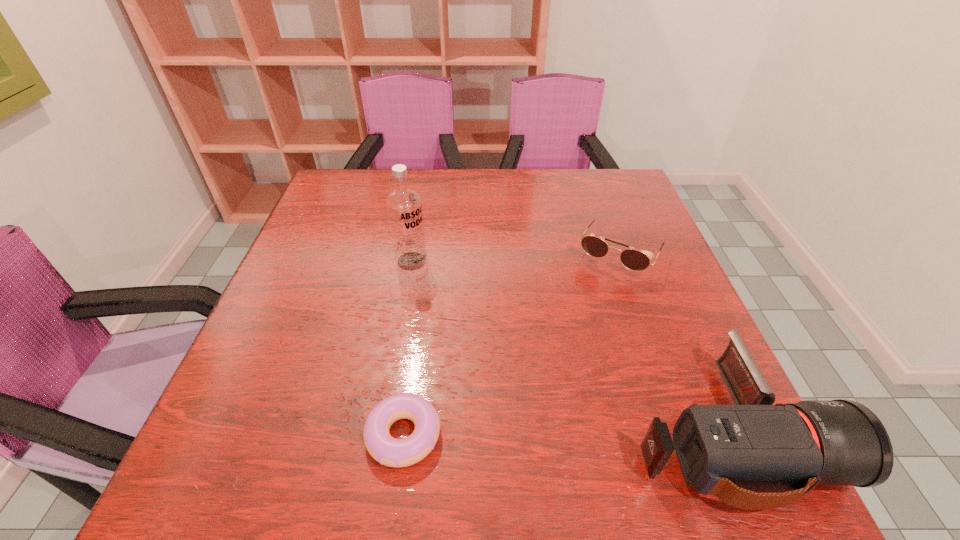
Where is `the shortest object`? This screenshot has height=540, width=960. the shortest object is located at coordinates (388, 451).

This screenshot has width=960, height=540. I want to click on camcorder, so click(x=729, y=451).

At what (x,y) coordinates should I click in order to perform the action: click on vodka. Please return your answer as a coordinate pair (x, y). The width and height of the screenshot is (960, 540). Looking at the image, I should click on (404, 205).

What are the coordinates of `sunglasses` in the screenshot? It's located at (635, 260).

Where is `blank area located 0.360m on the back of the shortest object`? This screenshot has width=960, height=540. blank area located 0.360m on the back of the shortest object is located at coordinates (425, 269).

The image size is (960, 540). Find the location of `free point located on the front label of the tallest object`. free point located on the front label of the tallest object is located at coordinates 484,344.

The width and height of the screenshot is (960, 540). Identify the location of vacant area located on the front label of the tallest object. (450, 305).

Find the location of `free point located 0.360m on the front label of the tallest object`. free point located 0.360m on the front label of the tallest object is located at coordinates (511, 375).

At what (x,y) coordinates should I click in order to perform the action: click on vacant space located on the front lenses of the sunglasses. Please return your answer as a coordinate pair (x, y). The height and width of the screenshot is (540, 960). Looking at the image, I should click on (551, 373).

At what (x,y) coordinates should I click in order to perform the action: click on free location located on the front lenses of the sunglasses. Please return your answer as a coordinate pair (x, y). The width and height of the screenshot is (960, 540). Looking at the image, I should click on (586, 313).